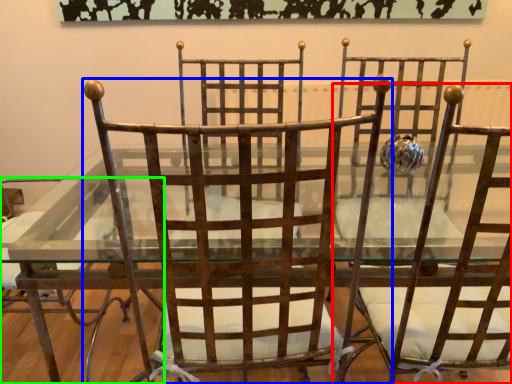
Question: Estimate the real-world distances between objects in this image. Which object is closer to chair (highlighted by a red box), chair (highlighted by a blue box) or chair (highlighted by a green box)?

Choices:
 (A) chair
 (B) chair

Answer: (A)